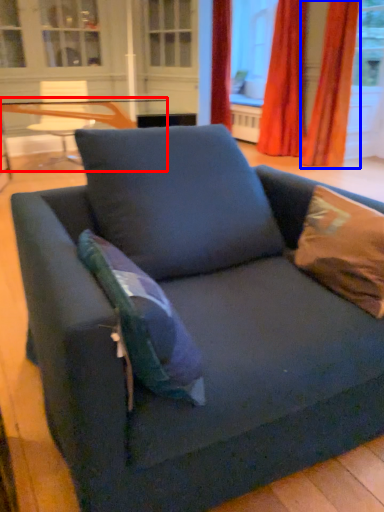
Question: Which object appears closest to the camera in this image, table (highlighted by a red box) or curtain (highlighted by a blue box)?

Choices:
 (A) table
 (B) curtain

Answer: (A)